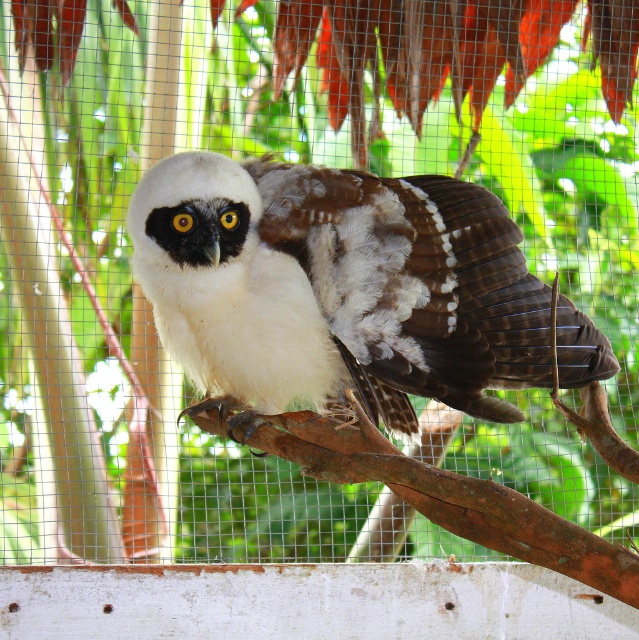
Question: Is white soft feathers at center thinner than brown rough tree branch at center?

Choices:
 (A) yes
 (B) no

Answer: (B)

Question: Which point is closer to the camera taking this photo?

Choices:
 (A) (199, 428)
 (B) (335, 337)

Answer: (B)

Question: Which point is farther to the camera?

Choices:
 (A) (527, 529)
 (B) (512, 305)

Answer: (B)

Question: Observing the image, what is the correct spatial positioning of white soft feathers at center in reference to brown rough tree branch at center?

Choices:
 (A) right
 (B) left

Answer: (B)

Question: Which of the following is the closest to the observer?

Choices:
 (A) brown rough tree branch at center
 (B) white soft feathers at center

Answer: (A)

Question: Where is white soft feathers at center located in relation to brown rough tree branch at center in the image?

Choices:
 (A) above
 (B) below

Answer: (A)